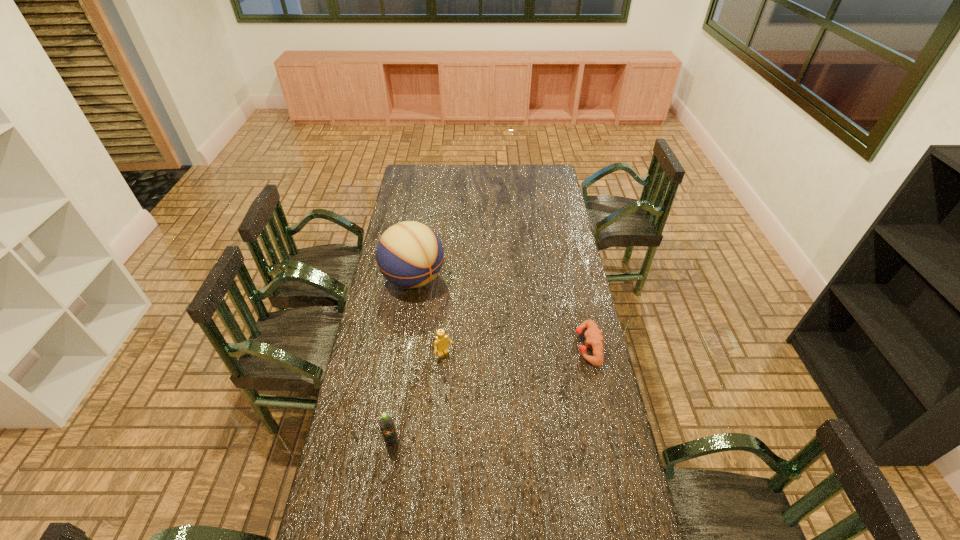
What are the coordinates of `vacant space on the desktop that is between the nearest object and the puncher and is positioned on the face of the second shortest object` in the screenshot? It's located at (479, 399).

This screenshot has height=540, width=960. Find the location of `vacant space on the desktop that is between the nearest object and the puncher and is positioned on the patterned surface of the tallest object`. vacant space on the desktop that is between the nearest object and the puncher and is positioned on the patterned surface of the tallest object is located at coordinates (526, 376).